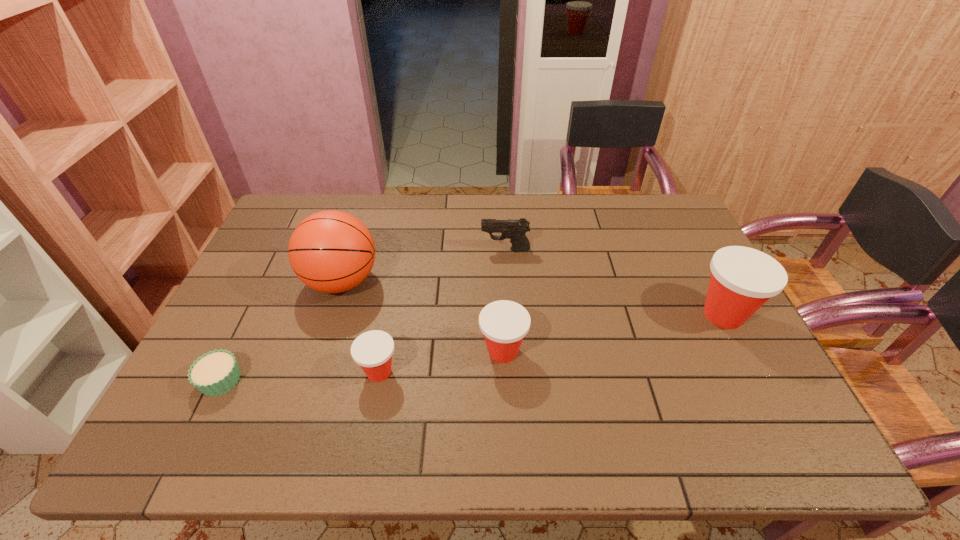
The height and width of the screenshot is (540, 960). I want to click on object that is at the right edge, so click(742, 279).

You are a GUI agent. You are given a task and a screenshot of the screen. Output one action in this format:
    pyautogui.click(x=<x>, y=<y>)
    Task: Click on the object present at the near left corner
    Image resolution: width=960 pixels, height=540 pixels.
    Given the screenshot: What is the action you would take?
    pyautogui.click(x=215, y=373)

In the image, there is a desktop. Where is `free space at the far edge`? The image size is (960, 540). free space at the far edge is located at coordinates (441, 231).

Find the location of a particular element. The image size is (960, 540). free location at the near edge is located at coordinates (612, 403).

This screenshot has height=540, width=960. Find the location of `vacant space at the left edge`. vacant space at the left edge is located at coordinates (258, 349).

The width and height of the screenshot is (960, 540). I want to click on free spot at the right edge of the desktop, so click(684, 245).

In the image, there is a desktop. Identify the location of blank space at the far left corner. (287, 210).

In the image, there is a desktop. Where is `vacant space at the far right corner`? vacant space at the far right corner is located at coordinates (641, 212).

Where is `vacant region at the near right corner`? The height and width of the screenshot is (540, 960). vacant region at the near right corner is located at coordinates (736, 389).

You are a GUI agent. You are given a task and a screenshot of the screen. Output one action in this format:
    pyautogui.click(x=<x>, y=<y>)
    Task: Click on the free spot between the shortest object and the basketball
    The image size is (960, 540).
    Given the screenshot: What is the action you would take?
    pyautogui.click(x=281, y=330)